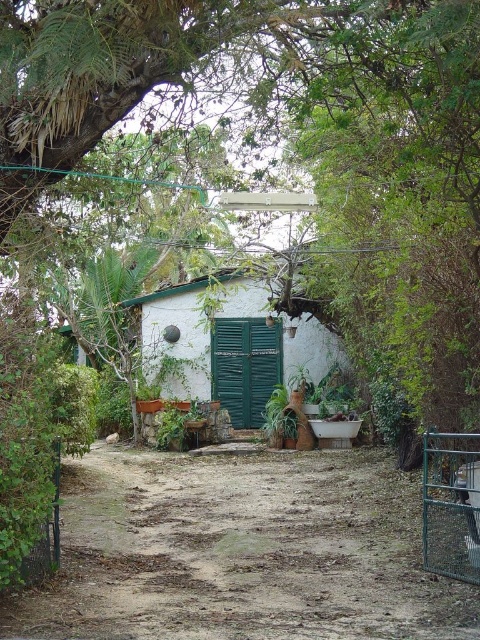
Between white stucco hut at center and green metal gate at lower right, which one appears on the left side from the viewer's perspective?

white stucco hut at center is more to the left.

Between point (202, 392) and point (458, 563), which one is positioned in front?

Point (458, 563)

Who is more forward, (247, 349) or (437, 550)?

Point (437, 550)

Identify the location of white stucco hut at center. The height and width of the screenshot is (640, 480). (229, 342).

Where is `dirt ground at center`? dirt ground at center is located at coordinates (241, 552).

Between dirt ground at center and white stucco hut at center, which one appears on the left side from the viewer's perspective?

white stucco hut at center

Who is more distant from viewer, (173, 573) or (256, 403)?

The point (256, 403) is more distant.

The width and height of the screenshot is (480, 640). Identify the location of dirt ground at center. (241, 552).

Which of these two, white stucco hut at center or metallic wire fence at lower left, stands taller?

white stucco hut at center

Which is above, white stucco hut at center or metallic wire fence at lower left?

white stucco hut at center

The image size is (480, 640). What do you see at coordinates (229, 342) in the screenshot?
I see `white stucco hut at center` at bounding box center [229, 342].

I want to click on white stucco hut at center, so click(x=229, y=342).